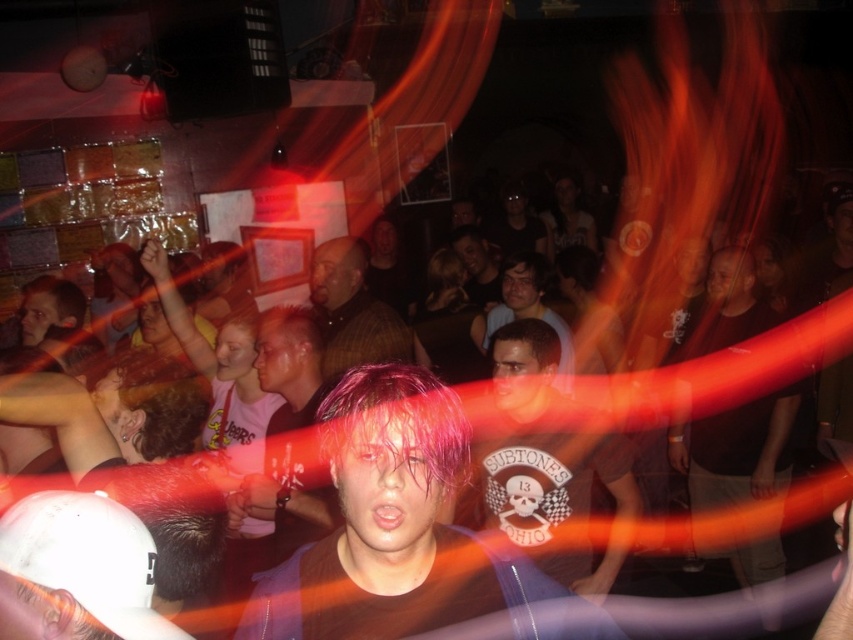
Question: Which of the following is the closest to the observer?

Choices:
 (A) shiny purple hair at center
 (B) white matte baseball cap at lower left

Answer: (B)

Question: Is dark brown shirt at center to the left of smooth brown hair at center from the viewer's perspective?

Choices:
 (A) no
 (B) yes

Answer: (A)

Question: Among these points, which one is nearest to the camera?

Choices:
 (A) (428, 410)
 (B) (380, 346)
 (C) (302, 468)

Answer: (A)

Question: Does dark brown shirt at center have a smaller size compared to plaid shirt at center?

Choices:
 (A) yes
 (B) no

Answer: (A)

Question: Is white matte baseball cap at lower left wider than dark brown shirt at center?

Choices:
 (A) yes
 (B) no

Answer: (B)

Question: Among these objects, which one is nearest to the camera?

Choices:
 (A) pink hair at center
 (B) smooth brown hair at center

Answer: (A)